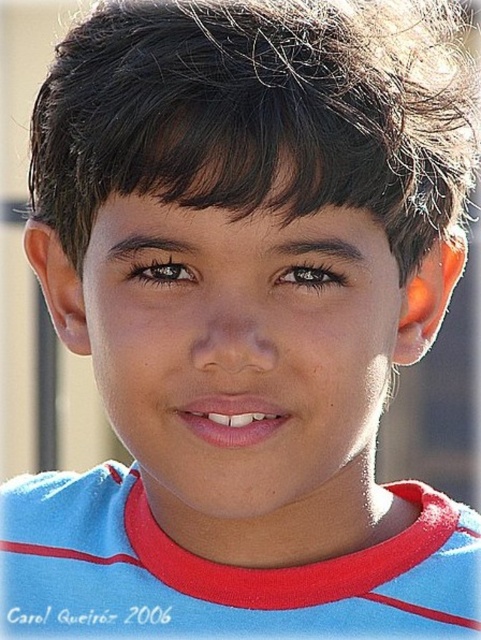
Looking at the boy in the portrait, where is the dark brown shiny hair at center in relation to the blue fabric shirt at center?

The dark brown shiny hair at center is to the right of the blue fabric shirt at center.

Looking at the image of the young boy, where is the smooth skin face at center in relation to the blue fabric shirt at center?

The smooth skin face at center is to the right of the blue fabric shirt at center.